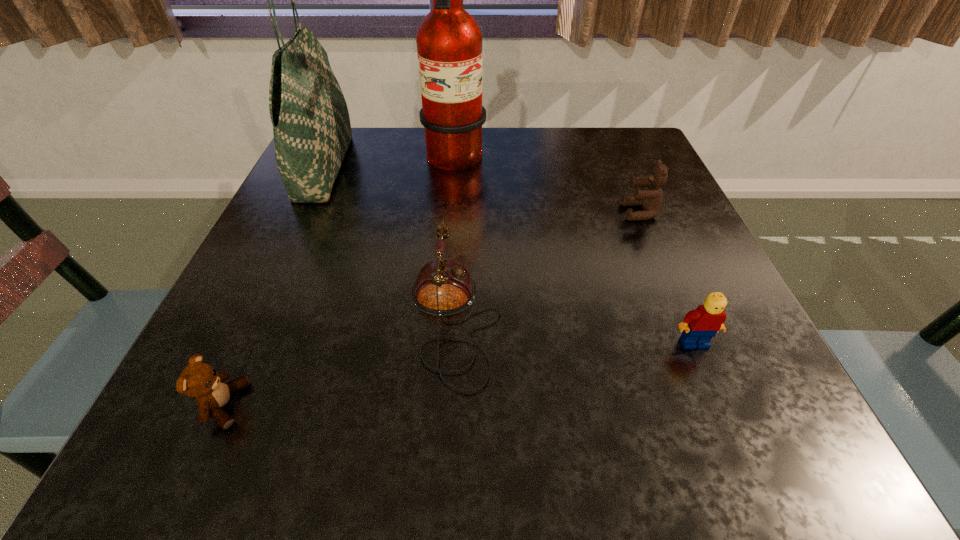
Image resolution: width=960 pixels, height=540 pixels. I want to click on fire extinguisher, so click(x=449, y=41).

Find the location of a particular element. tote bag is located at coordinates (311, 125).

Find the location of `the taller teddy bear`. the taller teddy bear is located at coordinates (650, 199).

Locate an element on the screen. The height and width of the screenshot is (540, 960). the farther teddy bear is located at coordinates (650, 199).

Locate an element on the screen. Lego is located at coordinates (700, 325).

Locate an element on the screen. Image resolution: width=960 pixels, height=540 pixels. telephone is located at coordinates (443, 287).

What are the coordinates of `the nearer teddy bear` in the screenshot? It's located at (199, 380).

At what (x,y) coordinates should I click in order to perform the action: click on the shorter teddy bear. Please return your answer as a coordinate pair (x, y). The image size is (960, 540). Looking at the image, I should click on (199, 380).

Identify the location of free space located 0.130m on the nozzle and handle of the fire extinguisher. This screenshot has height=540, width=960. (541, 162).

Locate an element on the screen. This screenshot has height=540, width=960. blank space located 0.280m on the front of the tote bag is located at coordinates (x=252, y=320).